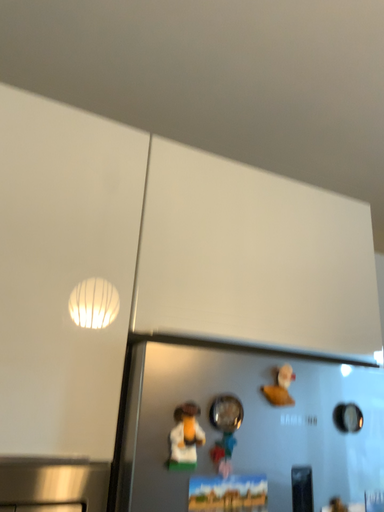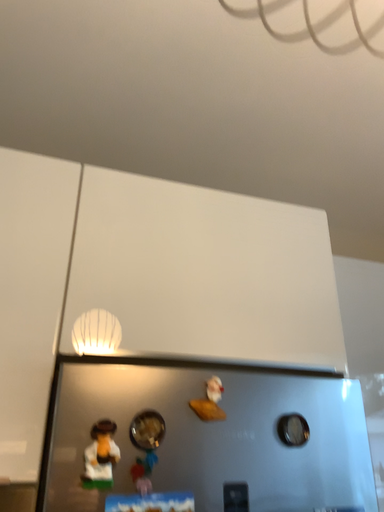
Question: How did the camera likely rotate when shooting the video?

Choices:
 (A) rotated left
 (B) rotated right

Answer: (A)